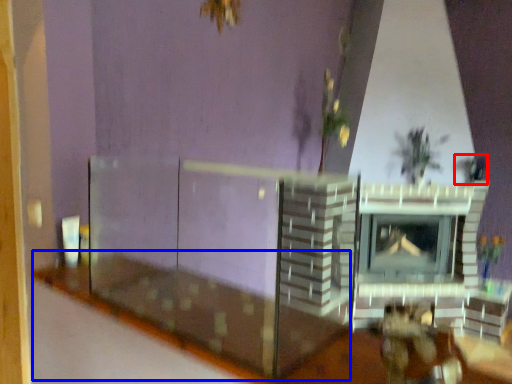
Question: Which object appears closest to the camera in this image, plant (highlighted by a red box) or table (highlighted by a blue box)?

Choices:
 (A) plant
 (B) table

Answer: (B)